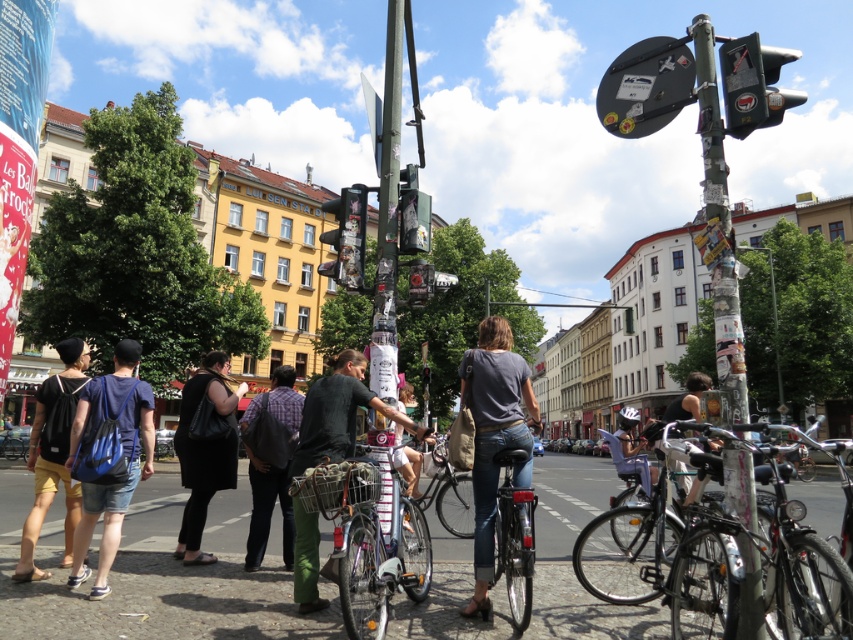
Is point (614, 557) positioned in front of point (630, 100)?

No, it is behind (630, 100).

Is shiny black bicycle at lower right below sticker-covered circular sign at upper right?

Yes.

I want to click on shiny black bicycle at lower right, so click(619, 534).

Which is behind, point (76, 536) or point (631, 420)?

The point (631, 420) is more distant.

Between blue fabric backpack at lower left and metallic silver helmet at center, which one has more height?

metallic silver helmet at center

Between point (70, 586) and point (621, 416), which one is positioned in front?

Point (70, 586) is in front.

Find the location of a particular element. Image resolution: width=853 pixels, height=640 pixels. blue fabric backpack at lower left is located at coordinates (122, 452).

Does dark green pants at center have a greater height compared to shiny black bicycle at lower right?

Incorrect, dark green pants at center's height is not larger of shiny black bicycle at lower right's.

Identify the location of dark green pants at center. (339, 413).

This screenshot has height=640, width=853. I want to click on dark green pants at center, so click(339, 413).